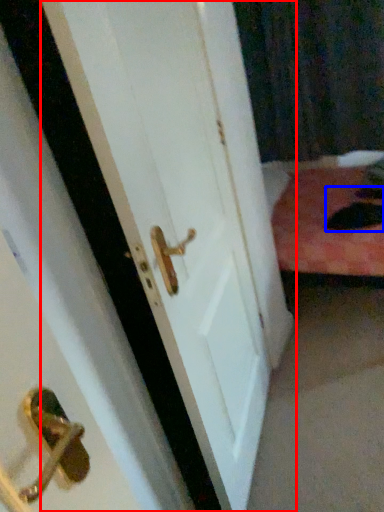
Question: Which of the following is the farthest to the observer, door (highlighted by a red box) or cat (highlighted by a blue box)?

Choices:
 (A) door
 (B) cat

Answer: (B)